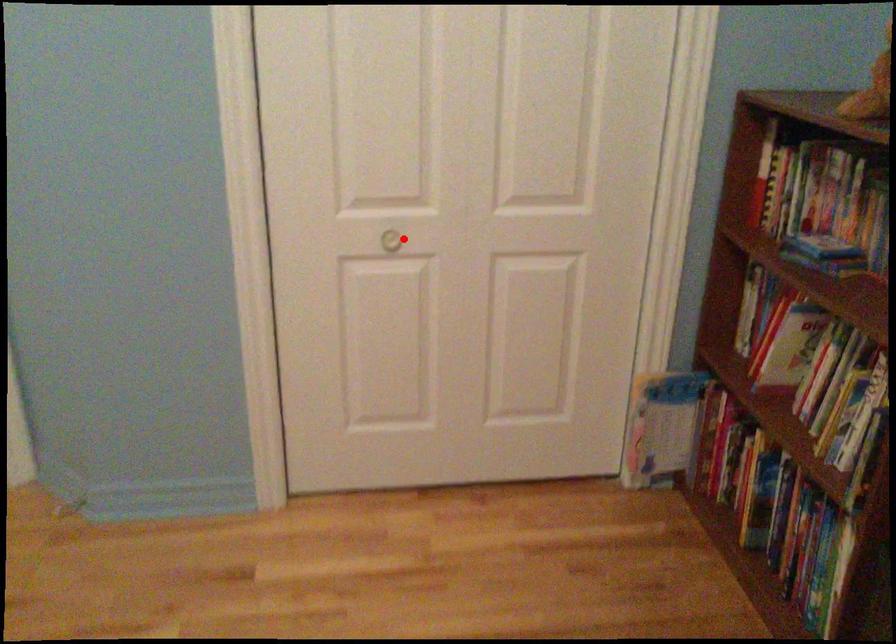
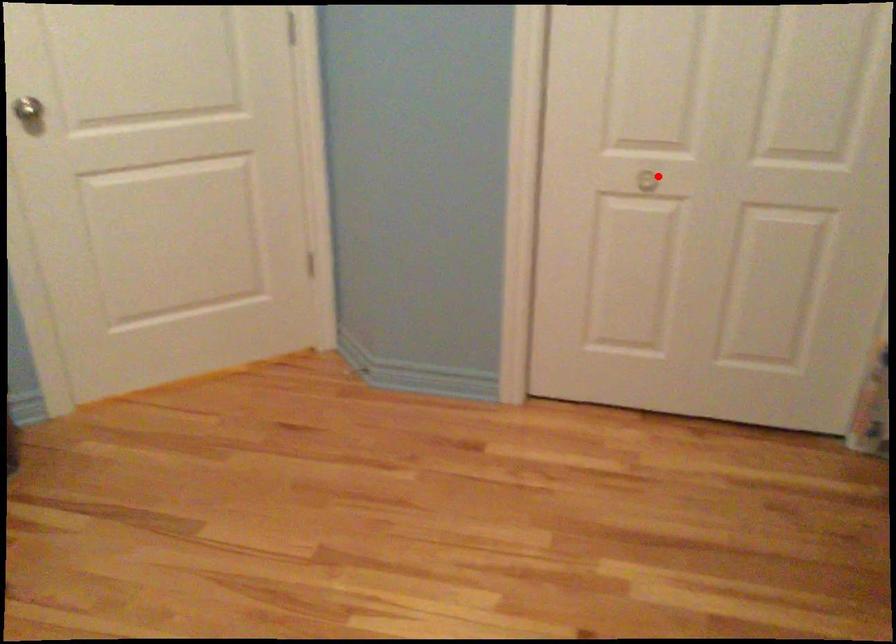
I am providing you with two images of the same scene from different viewpoints. A red point is marked on the first image and another point is marked on the second image. Is the red point in image1 aligned with the point shown in image2?

Yes